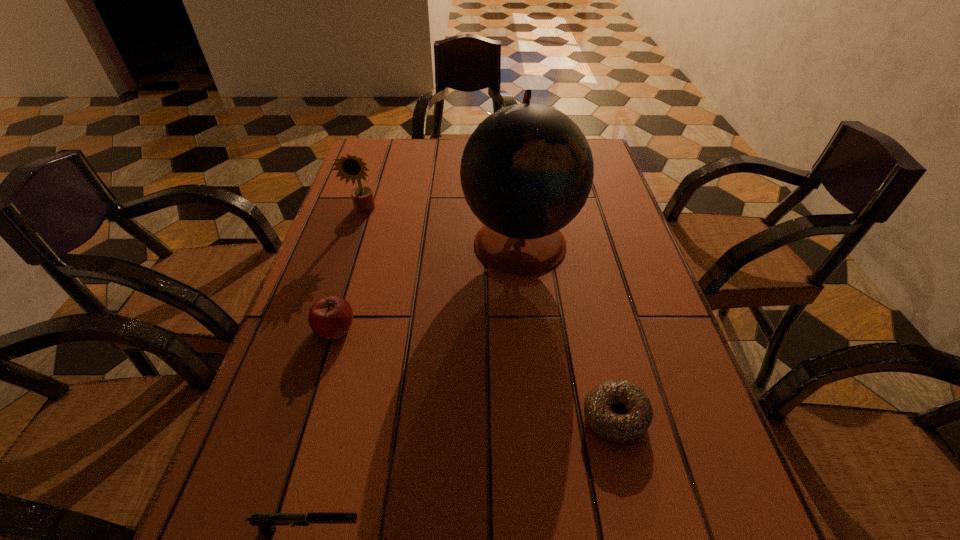
Where is `vacant space at the far edge of the desktop`? The height and width of the screenshot is (540, 960). vacant space at the far edge of the desktop is located at coordinates (417, 139).

Where is `vacant space at the left edge of the desktop`? vacant space at the left edge of the desktop is located at coordinates (377, 222).

This screenshot has width=960, height=540. In order to click on free point at the right edge in this screenshot , I will do `click(625, 208)`.

I want to click on vacant space at the far left corner, so click(x=386, y=157).

Identify the location of vacant area between the globe and the fourth farthest object. The width and height of the screenshot is (960, 540). (567, 329).

What are the coordinates of `vacant space that is in between the tallest object and the nearest object` in the screenshot? It's located at (415, 385).

The image size is (960, 540). What are the coordinates of `free spot between the second nearest object and the third tallest object` in the screenshot? It's located at (475, 373).

Image resolution: width=960 pixels, height=540 pixels. Find the location of `vacant space that's between the gun and the second nearest object`. vacant space that's between the gun and the second nearest object is located at coordinates (462, 474).

I want to click on free space between the globe and the gun, so click(415, 385).

Where is `free spot between the nearest object and the second nearest object`? Image resolution: width=960 pixels, height=540 pixels. free spot between the nearest object and the second nearest object is located at coordinates coord(462,474).